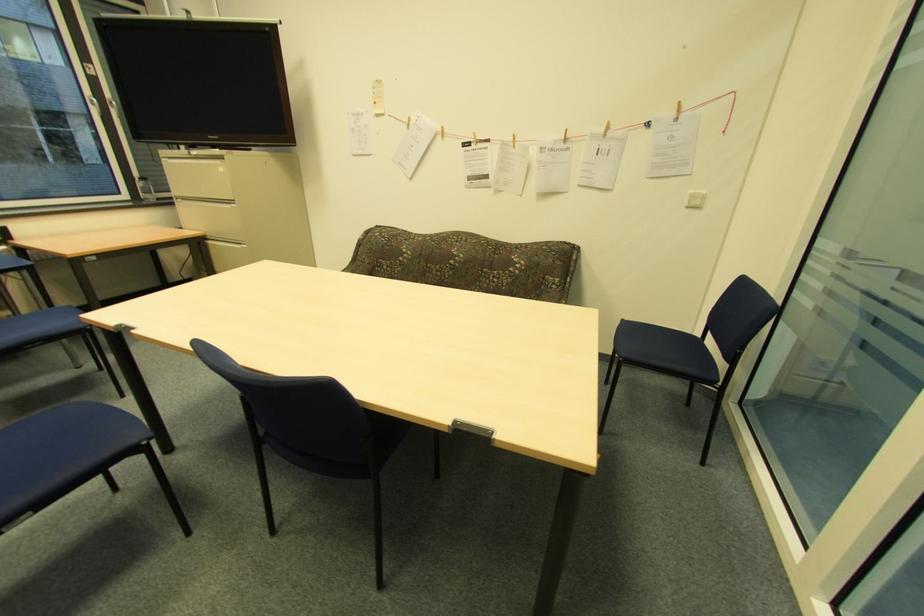
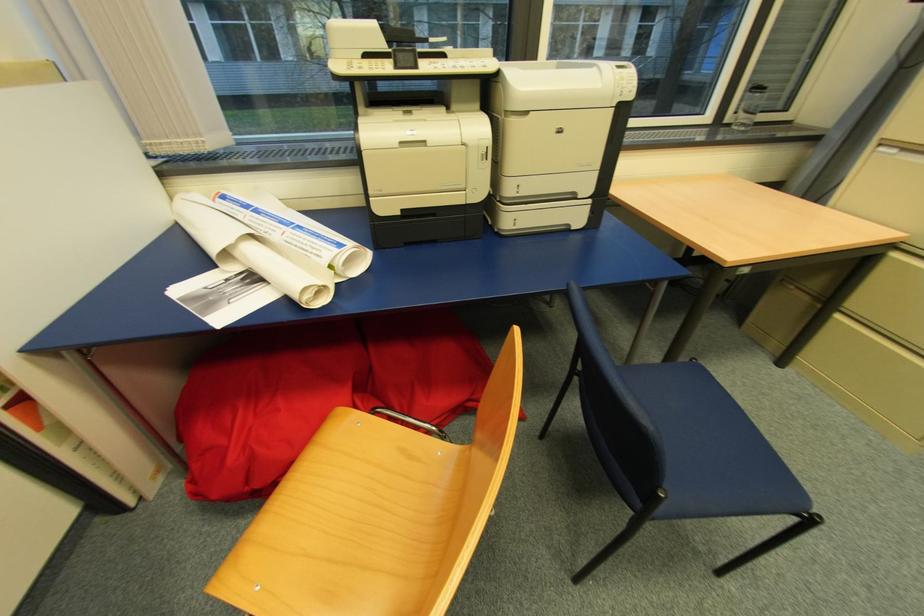
In the second image, find the point that corresponds to [186,199] in the first image.

(902, 150)